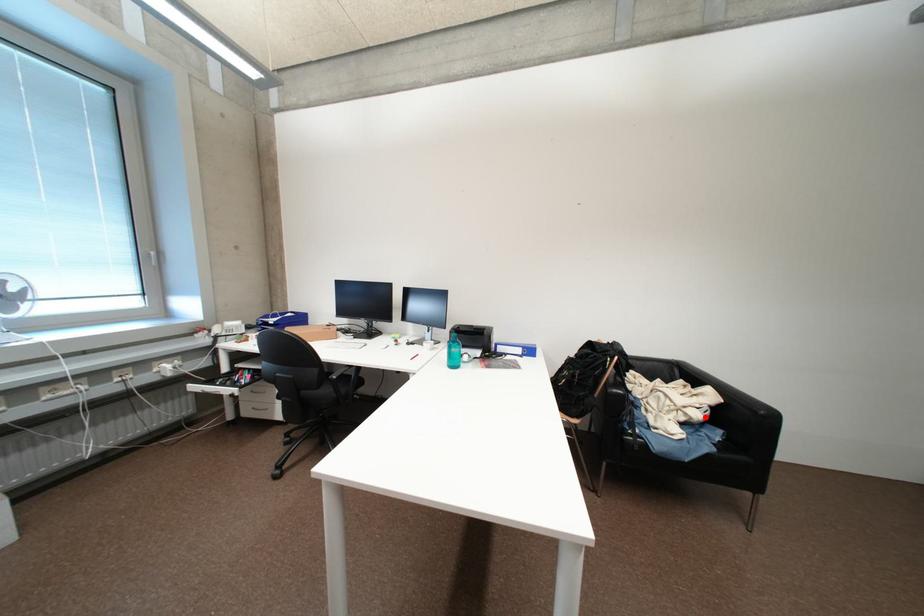
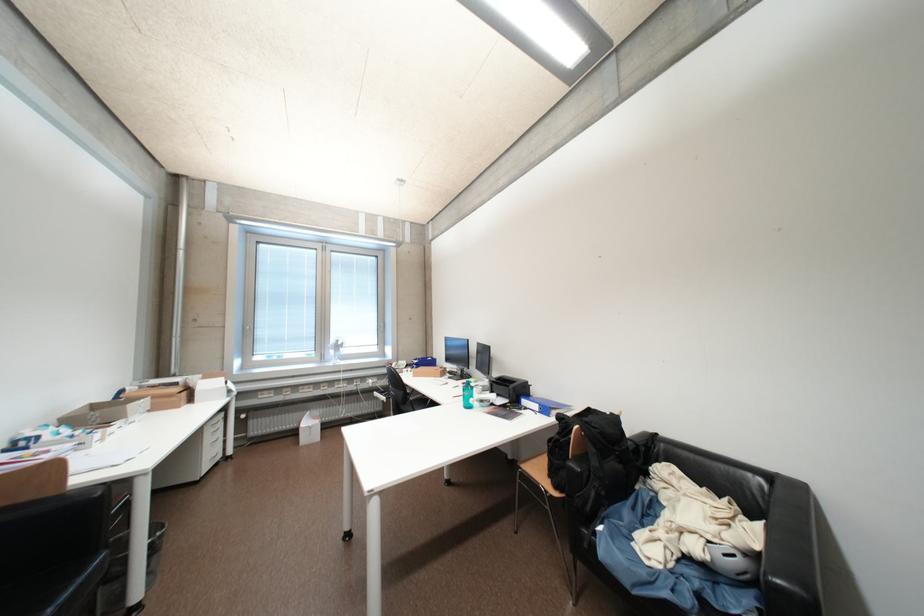
Question: A red point is marked in image1. In image2, is the corresponding 3D point closer to the camera or farther? Reply with the corresponding letter.

Choices:
 (A) The corresponding 3D point is closer.
 (B) The corresponding 3D point is farther.

Answer: (A)